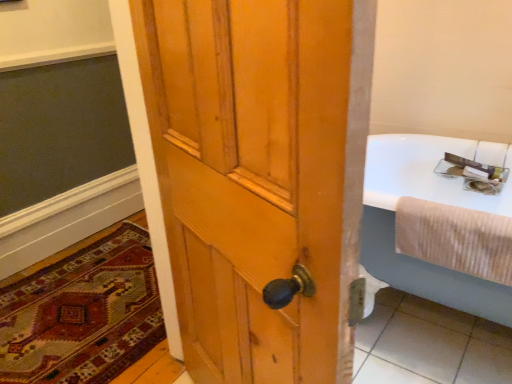
Question: Considering the positions of beige ribbed towel at right and carpeted rug at lower left in the image, is beige ribbed towel at right bigger or smaller than carpeted rug at lower left?

Choices:
 (A) big
 (B) small

Answer: (B)

Question: Do you think beige ribbed towel at right is within carpeted rug at lower left, or outside of it?

Choices:
 (A) inside
 (B) outside

Answer: (B)

Question: In terms of height, does beige ribbed towel at right look taller or shorter compared to carpeted rug at lower left?

Choices:
 (A) short
 (B) tall

Answer: (B)

Question: Is carpeted rug at lower left to the left or to the right of beige ribbed towel at right in the image?

Choices:
 (A) left
 (B) right

Answer: (A)

Question: Considering the positions of carpeted rug at lower left and beige ribbed towel at right in the image, is carpeted rug at lower left taller or shorter than beige ribbed towel at right?

Choices:
 (A) short
 (B) tall

Answer: (A)

Question: Considering the positions of carpeted rug at lower left and beige ribbed towel at right in the image, is carpeted rug at lower left bigger or smaller than beige ribbed towel at right?

Choices:
 (A) small
 (B) big

Answer: (B)

Question: Would you say carpeted rug at lower left is inside or outside beige ribbed towel at right?

Choices:
 (A) outside
 (B) inside

Answer: (A)